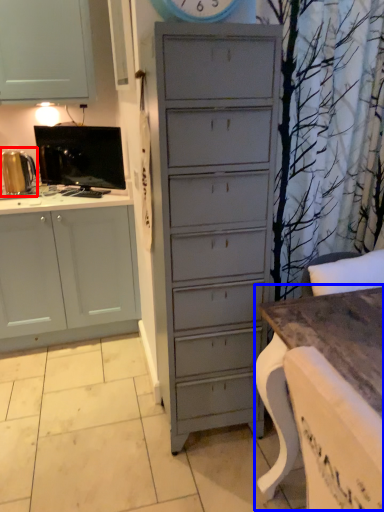
Question: Which object is further to the camera taking this photo, appliance (highlighted by a red box) or table (highlighted by a blue box)?

Choices:
 (A) appliance
 (B) table

Answer: (A)